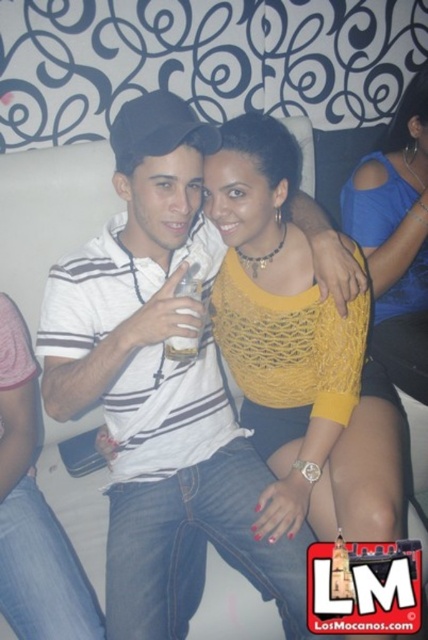
Is white striped shirt at center thinner than blue mesh top at upper right?

Incorrect, white striped shirt at center's width is not less than blue mesh top at upper right's.

Does white striped shirt at center appear on the left side of blue mesh top at upper right?

Yes, white striped shirt at center is to the left of blue mesh top at upper right.

The height and width of the screenshot is (640, 428). I want to click on white striped shirt at center, so click(160, 390).

You are a GUI agent. You are given a task and a screenshot of the screen. Output one action in this format:
    pyautogui.click(x=<x>, y=<y>)
    Task: Click on the white striped shirt at center
    This screenshot has height=640, width=428.
    Given the screenshot: What is the action you would take?
    pyautogui.click(x=160, y=390)

Is white striped shirt at center bigger than yellow knitted top at center?

Yes, white striped shirt at center is bigger than yellow knitted top at center.

Locate an element on the screen. This screenshot has height=640, width=428. white striped shirt at center is located at coordinates (160, 390).

Is point (145, 426) less distant than point (303, 269)?

Yes, point (145, 426) is closer to viewer.

The image size is (428, 640). I want to click on white striped shirt at center, so click(x=160, y=390).

Is point (293, 524) positioned after point (363, 160)?

No, (293, 524) is in front of (363, 160).

Is yellow knitted top at center thinner than blue mesh top at upper right?

Incorrect, yellow knitted top at center's width is not less than blue mesh top at upper right's.

Where is `yellow knitted top at center`? The height and width of the screenshot is (640, 428). yellow knitted top at center is located at coordinates (279, 320).